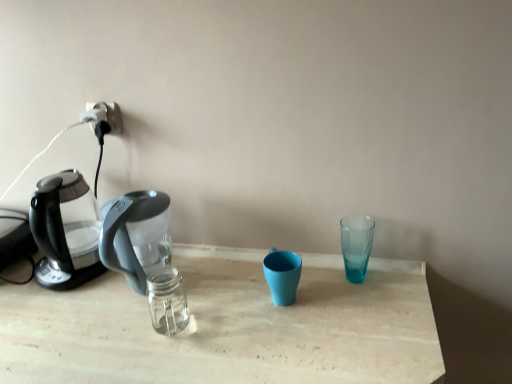
Question: Considering the positions of matte blue cup at center, the 2th coffee cup when ordered from right to left, and transparent glass at right, the first coffee cup in the right-to-left sequence, in the image, is matte blue cup at center, the 2th coffee cup when ordered from right to left, wider or thinner than transparent glass at right, the first coffee cup in the right-to-left sequence,?

Choices:
 (A) thin
 (B) wide

Answer: (B)

Question: Is matte blue cup at center, which is counted as the 1th coffee cup, starting from the left, taller or shorter than transparent glass at right, the first coffee cup in the right-to-left sequence?

Choices:
 (A) tall
 (B) short

Answer: (B)

Question: Estimate the real-world distances between objects in this image. Which object is closer to the white plastic plug at upper left?

Choices:
 (A) transparent plastic kettle at left
 (B) matte blue cup at center, the 2th coffee cup when ordered from right to left
 (C) transparent glass at right, the first coffee cup in the right-to-left sequence

Answer: (A)

Question: Considering the real-world distances, which object is closest to the transparent glass at right, which is counted as the 2th coffee cup, starting from the left?

Choices:
 (A) matte blue cup at center, the 2th coffee cup when ordered from right to left
 (B) white plastic plug at upper left
 (C) transparent plastic kettle at left

Answer: (A)